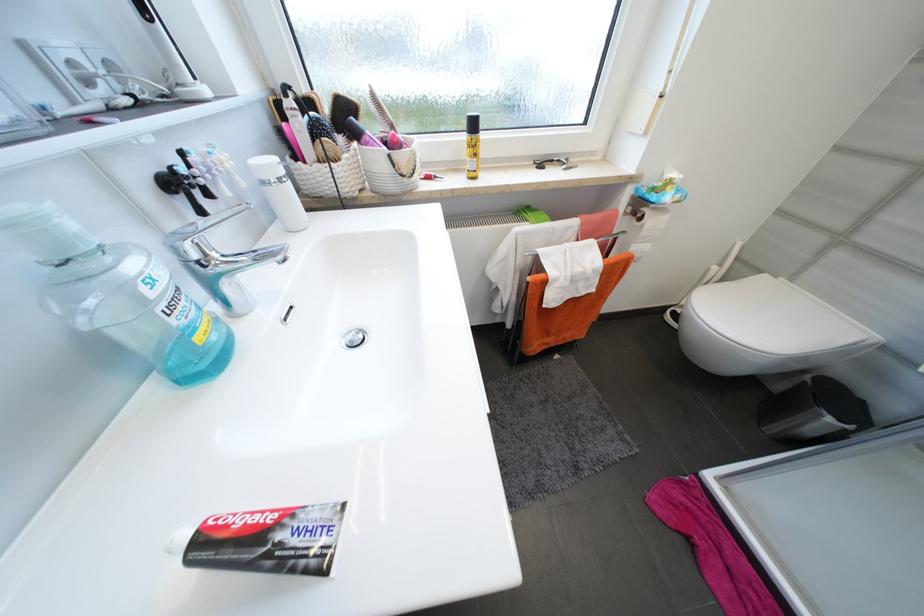
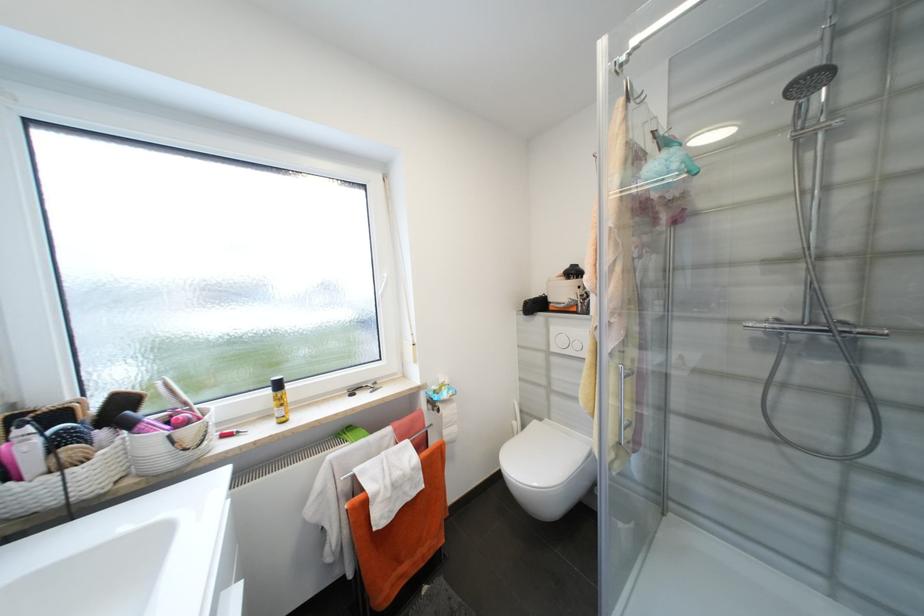
The point at (362, 136) is marked in the first image. Where is the corresponding point in the second image?

(134, 427)